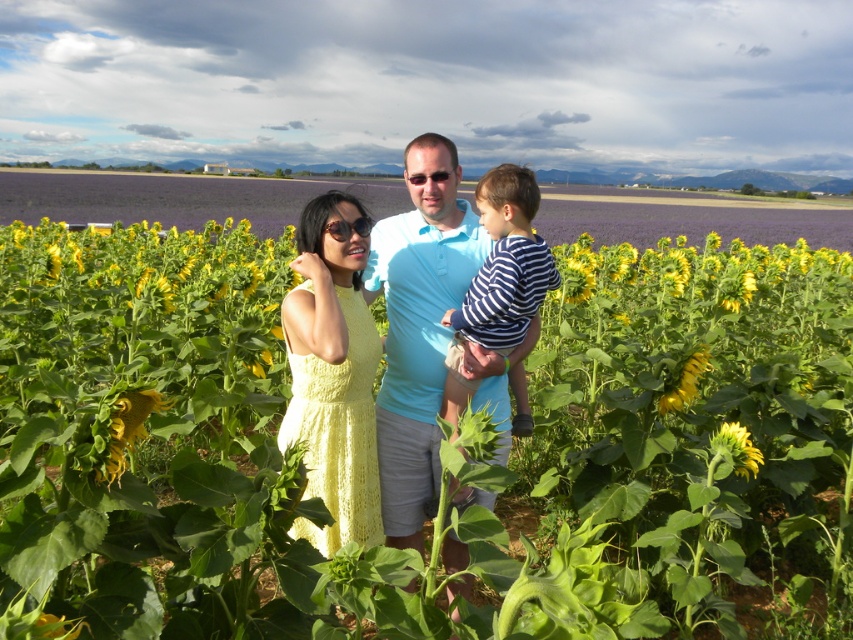
Does light yellow knit dress at center appear on the left side of yellow knitted dress at center?

Incorrect, light yellow knit dress at center is not on the left side of yellow knitted dress at center.

Is light yellow knit dress at center to the right of yellow knitted dress at center from the viewer's perspective?

Correct, you'll find light yellow knit dress at center to the right of yellow knitted dress at center.

Measure the distance between point (440, 236) and camera.

A distance of 2.74 meters exists between point (440, 236) and camera.

You are a GUI agent. You are given a task and a screenshot of the screen. Output one action in this format:
    pyautogui.click(x=<x>, y=<y>)
    Task: Click on the light yellow knit dress at center
    
    Given the screenshot: What is the action you would take?
    pyautogui.click(x=418, y=326)

Can you confirm if light yellow knit dress at center is wider than striped cotton shirt at center?

Yes.

Is light yellow knit dress at center closer to the viewer compared to striped cotton shirt at center?

Yes, it is in front of striped cotton shirt at center.

Is point (457, 497) farther from camera compared to point (473, 316)?

No, (457, 497) is in front of (473, 316).

You are a GUI agent. You are given a task and a screenshot of the screen. Output one action in this format:
    pyautogui.click(x=<x>, y=<y>)
    Task: Click on the light yellow knit dress at center
    
    Given the screenshot: What is the action you would take?
    pyautogui.click(x=418, y=326)

Does yellow knitted dress at center appear on the right side of striped cotton shirt at center?

Incorrect, yellow knitted dress at center is not on the right side of striped cotton shirt at center.

Between yellow knitted dress at center and striped cotton shirt at center, which one appears on the left side from the viewer's perspective?

From the viewer's perspective, yellow knitted dress at center appears more on the left side.

Does point (311, 474) come closer to viewer compared to point (467, 308)?

Yes.

Where is `yellow knitted dress at center`? yellow knitted dress at center is located at coordinates (334, 372).